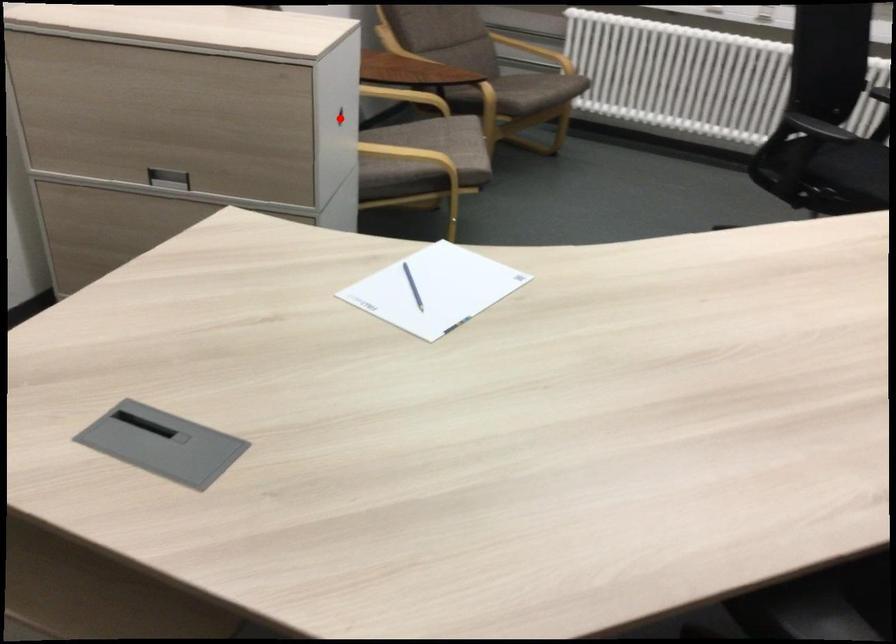
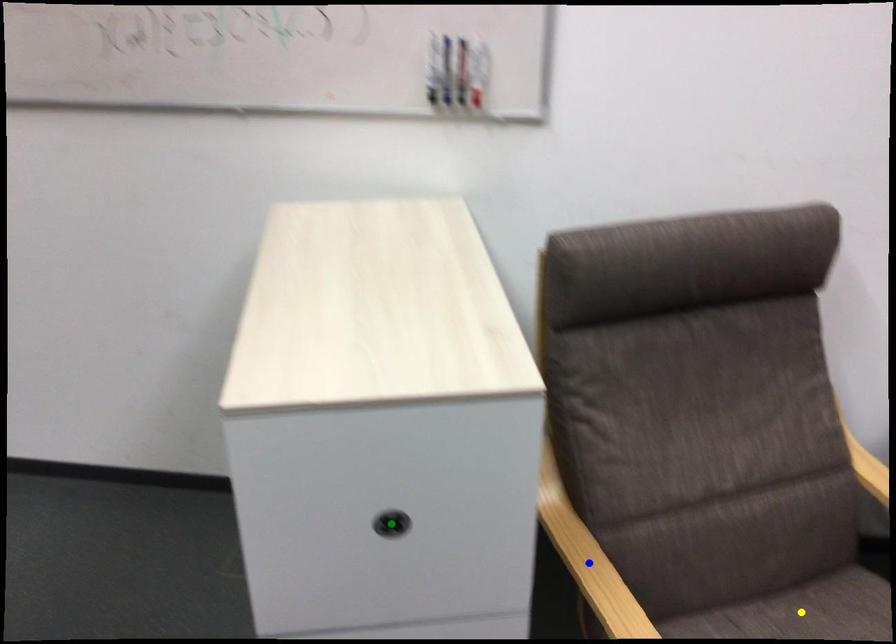
Question: I am providing you with two images of the same scene from different viewpoints. A red point is marked on the first image. You are given multiple points on the second image. Can you choose the point in image 2 that corresponds to the point in image 1?

Choices:
 (A) blue point
 (B) yellow point
 (C) green point

Answer: (C)